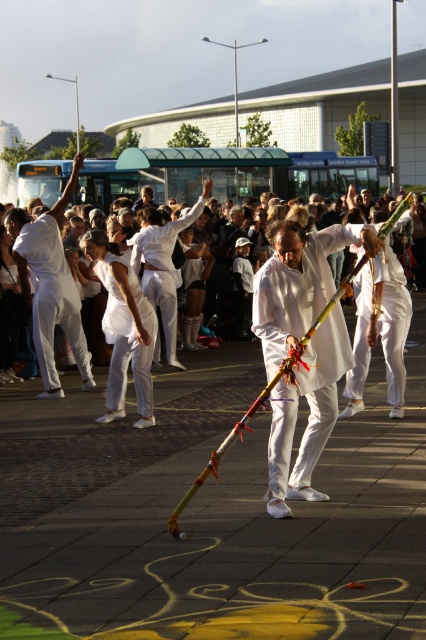
You are a photographer trying to capture the performers in the scene. You notice the white matte robe at center and the white clothed people at center. Which object is positioned to the right of the other?

The white matte robe at center is to the right of the white clothed people at center.

You are a photographer standing at the scene. You want to capture a closeup shot of the white matte robe at center. Considering your camera has a minimum focusing distance of 8 meters, will you be able to take the photo without moving closer?

The white matte robe at center is 7.99 meters away from viewer, which is just below the camera minimum focusing distance of 8 meters. Therefore, you can take the closeup shot without moving closer.